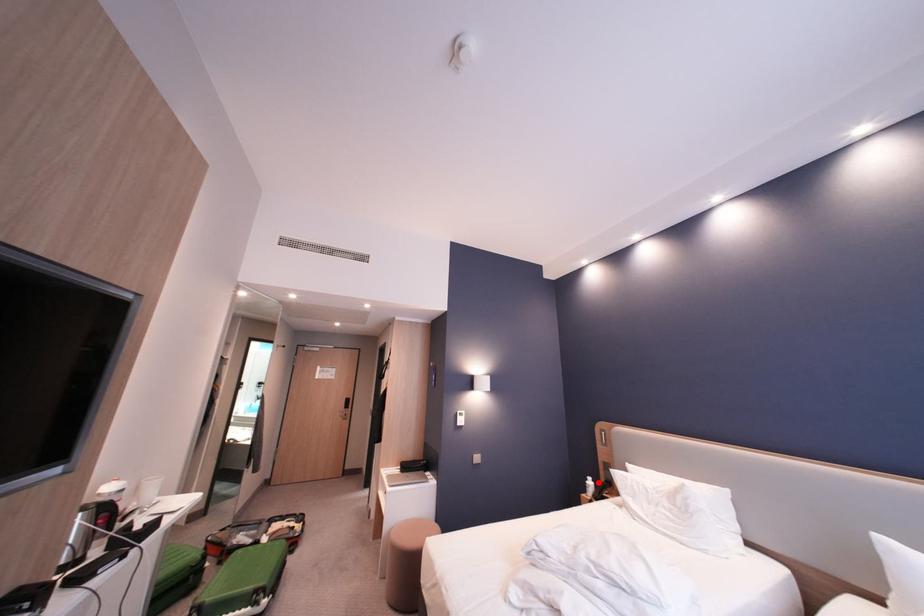
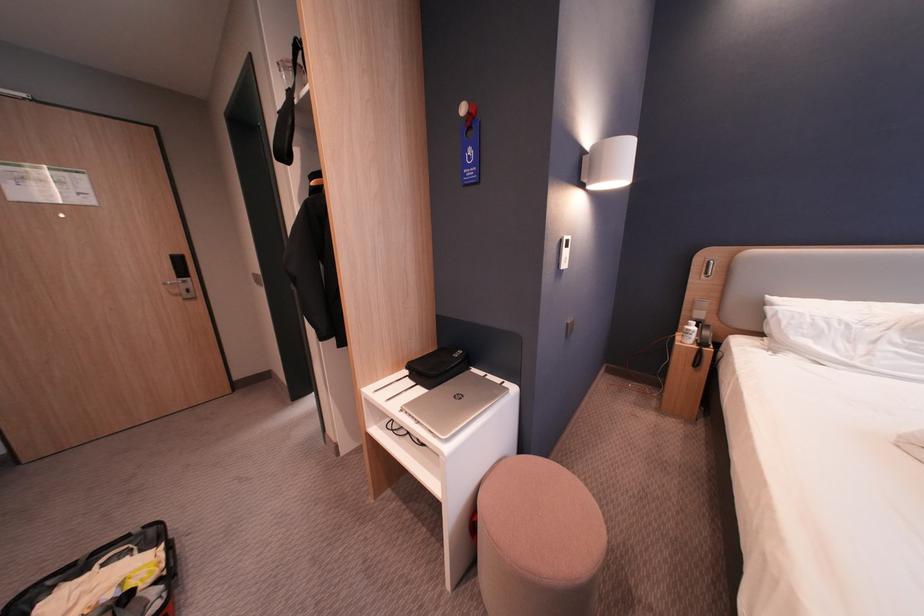
Question: A red point is marked in image1. In image2, is the corresponding 3D point closer to the camera or farther? Reply with the corresponding letter.

Choices:
 (A) The corresponding 3D point is closer.
 (B) The corresponding 3D point is farther.

Answer: (A)